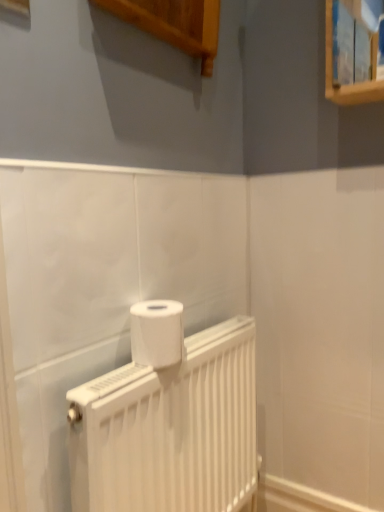
At what (x,y) coordinates should I click in order to perform the action: click on white matte toilet paper at center. Please return your answer as a coordinate pair (x, y). The image size is (384, 512). Looking at the image, I should click on (156, 333).

What do you see at coordinates (156, 333) in the screenshot? The height and width of the screenshot is (512, 384). I see `white matte toilet paper at center` at bounding box center [156, 333].

The width and height of the screenshot is (384, 512). Identify the location of white matte radiator at center. (170, 430).

Describe the element at coordinates (170, 430) in the screenshot. I see `white matte radiator at center` at that location.

Identify the location of white matte toilet paper at center. This screenshot has height=512, width=384. (156, 333).

In the scene shown: Considering the relative positions of white matte radiator at center and white matte toilet paper at center in the image provided, is white matte radiator at center to the left of white matte toilet paper at center from the viewer's perspective?

In fact, white matte radiator at center is to the right of white matte toilet paper at center.

Is white matte radiator at center positioned in front of white matte toilet paper at center?

Yes, the depth of white matte radiator at center is less than that of white matte toilet paper at center.

Is point (213, 488) farther from camera compared to point (140, 362)?

Yes, it is behind point (140, 362).

From the image's perspective, is white matte radiator at center beneath white matte toilet paper at center?

Yes.

From a real-world perspective, is white matte radiator at center physically below white matte toilet paper at center?

Yes.

Considering the relative sizes of white matte radiator at center and white matte toilet paper at center in the image provided, is white matte radiator at center thinner than white matte toilet paper at center?

Correct, the width of white matte radiator at center is less than that of white matte toilet paper at center.

Can you confirm if white matte radiator at center is shorter than white matte toilet paper at center?

No.

Who is smaller, white matte radiator at center or white matte toilet paper at center?

With smaller size is white matte toilet paper at center.

Would you say white matte radiator at center contains white matte toilet paper at center?

Actually, white matte toilet paper at center is outside white matte radiator at center.

Would you say white matte radiator at center is a long distance from white matte toilet paper at center?

No, there isn't a large distance between white matte radiator at center and white matte toilet paper at center.

Is white matte radiator at center oriented towards white matte toilet paper at center?

No, white matte radiator at center does not turn towards white matte toilet paper at center.

What's the angular difference between white matte radiator at center and white matte toilet paper at center's facing directions?

The angle between the facing direction of white matte radiator at center and the facing direction of white matte toilet paper at center is 0.00132 degrees.

Where is `toilet paper on the left of the white matte radiator at center`? The image size is (384, 512). toilet paper on the left of the white matte radiator at center is located at coordinates (156, 333).

Between white matte toilet paper at center and white matte radiator at center, which one appears on the right side from the viewer's perspective?

white matte radiator at center is more to the right.

Is white matte toilet paper at center in front of or behind white matte radiator at center in the image?

Clearly, white matte toilet paper at center is behind white matte radiator at center.

Between point (145, 311) and point (126, 490), which one is positioned in front?

Positioned in front is point (126, 490).

From the image's perspective, does white matte toilet paper at center appear higher than white matte radiator at center?

Yes, from the image's perspective, white matte toilet paper at center is above white matte radiator at center.

From a real-world perspective, is white matte toilet paper at center positioned under white matte radiator at center based on gravity?

No, from a real-world perspective, white matte toilet paper at center is not under white matte radiator at center.

Between white matte toilet paper at center and white matte radiator at center, which one has smaller width?

Thinner between the two is white matte radiator at center.

Considering the sizes of objects white matte toilet paper at center and white matte radiator at center in the image provided, who is shorter, white matte toilet paper at center or white matte radiator at center?

white matte toilet paper at center is shorter.

Is white matte toilet paper at center bigger or smaller than white matte radiator at center?

white matte toilet paper at center is smaller than white matte radiator at center.

From the picture: Is white matte toilet paper at center not within white matte radiator at center?

Indeed, white matte toilet paper at center is completely outside white matte radiator at center.

Based on the photo, are white matte toilet paper at center and white matte radiator at center making contact?

No, white matte toilet paper at center is not in contact with white matte radiator at center.

Is white matte radiator at center at the back of white matte toilet paper at center?

No, white matte toilet paper at center is not facing away from white matte radiator at center.

Consider the image. How far apart are white matte toilet paper at center and white matte radiator at center?

They are 7.69 inches apart.

The height and width of the screenshot is (512, 384). What are the coordinates of `toilet paper behind the white matte radiator at center` in the screenshot? It's located at (156, 333).

Identify the location of toilet paper lying above the white matte radiator at center (from the image's perspective). The image size is (384, 512). (156, 333).

Locate an element on the screen. The height and width of the screenshot is (512, 384). radiator below the white matte toilet paper at center (from the image's perspective) is located at coordinates (170, 430).